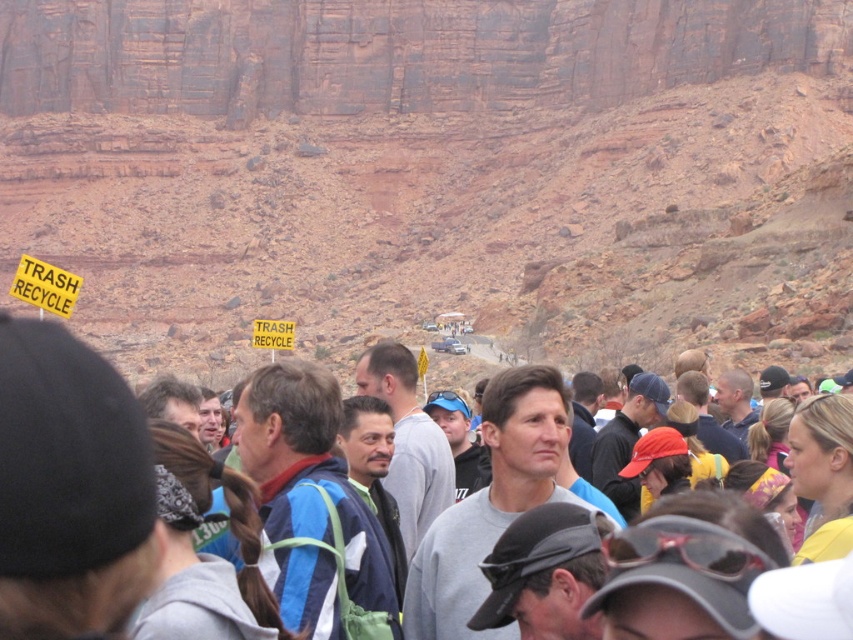
You are a photographer at the event and want to capture a photo of the gray casual clothing at center without the yellow paper sign at upper left blocking the view. Is this possible based on their positions?

The gray casual clothing at center is below the yellow paper sign at upper left, so the sign is positioned above it. Therefore, the yellow paper sign at upper left would block the view of the gray casual clothing at center unless the camera angle is adjusted to avoid the sign.

You are a photographer standing at the edge of the crowd, wanting to capture a photo of the gray casual clothing at center and the yellow paper sign at center. Which object will appear larger in your photo?

The gray casual clothing at center will appear larger in the photo because it is closer to the viewer than the yellow paper sign at center.